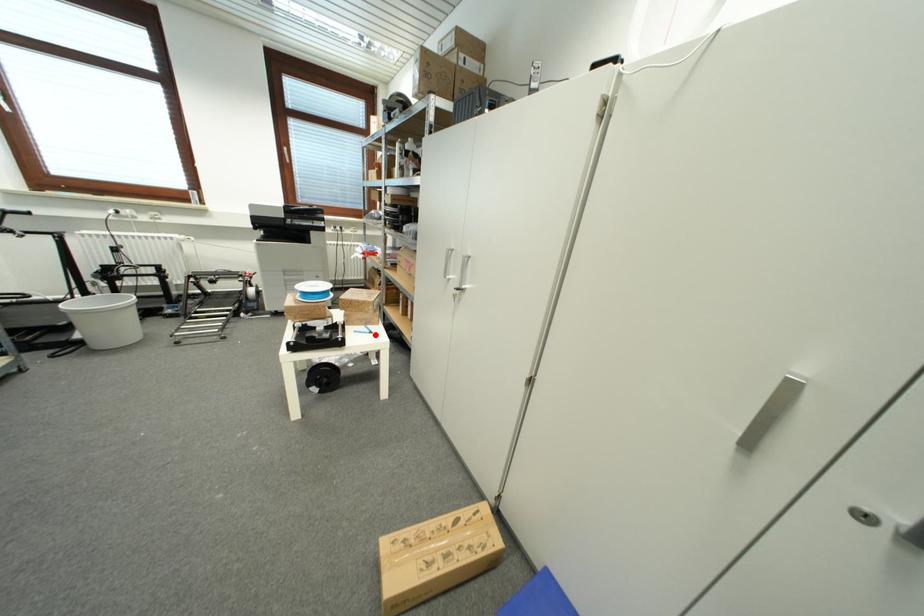
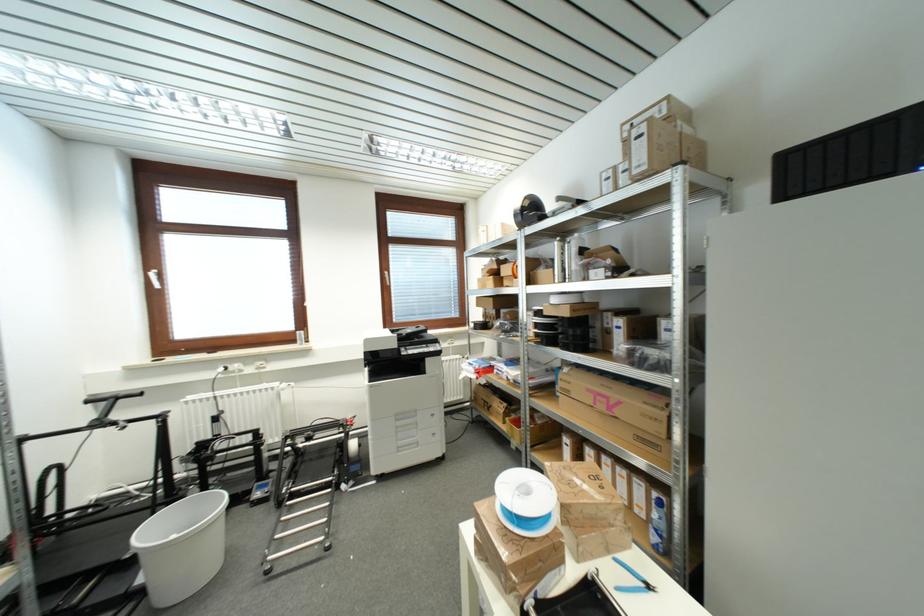
Find the pixel in the second image that matches the highlighted location in the first image.

(652, 590)